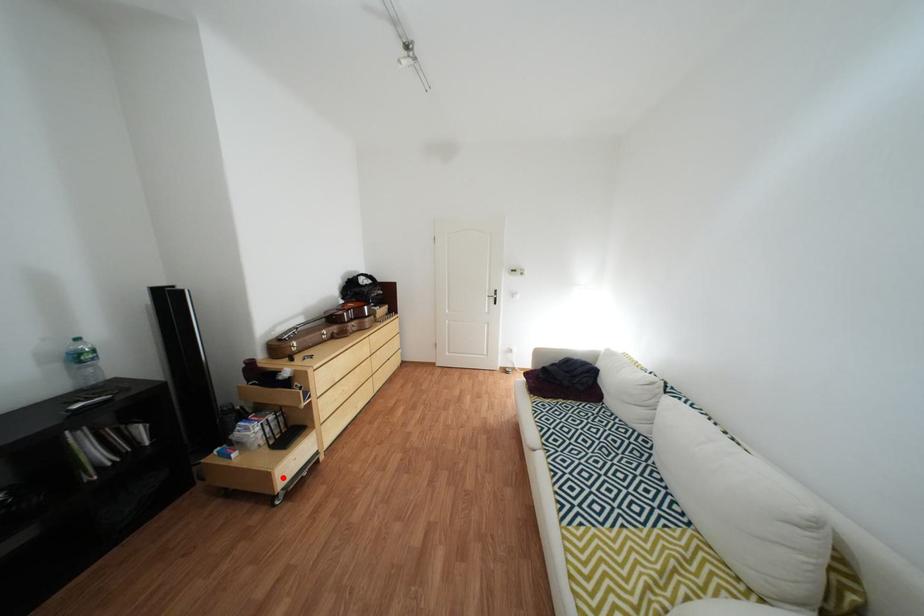
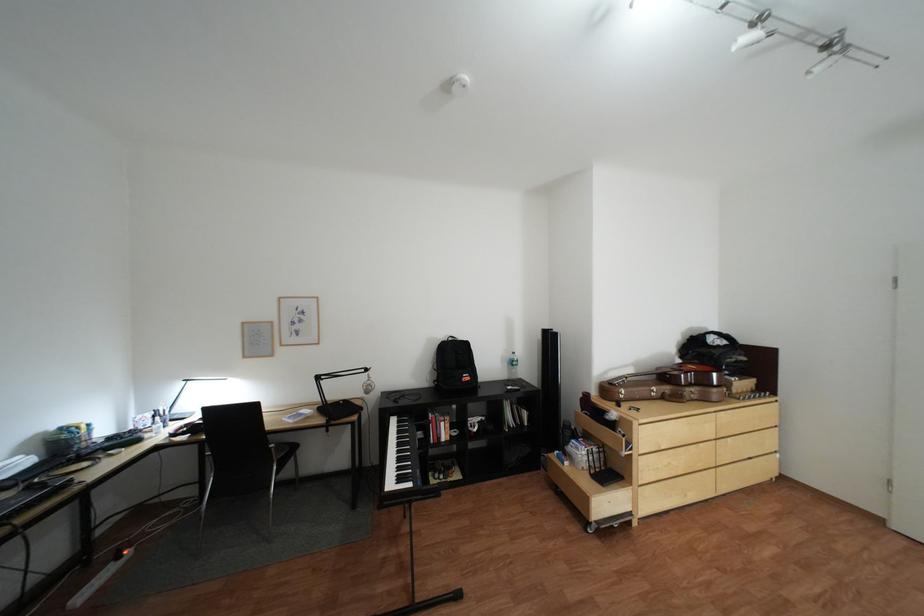
Question: A red point is marked in image1. In image2, is the corresponding 3D point closer to the camera or farther? Reply with the corresponding letter.

Choices:
 (A) The corresponding 3D point is closer.
 (B) The corresponding 3D point is farther.

Answer: (B)